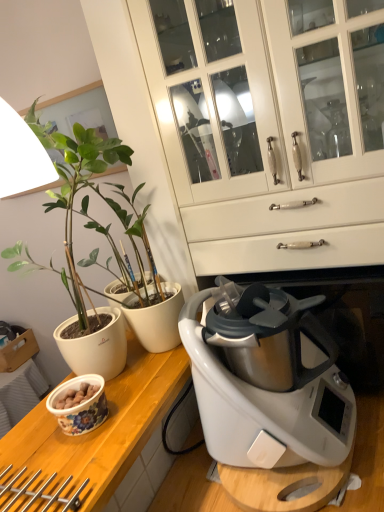
Question: From their relative heights in the image, would you say wooden at left is taller or shorter than matte white pot at left?

Choices:
 (A) tall
 (B) short

Answer: (B)

Question: Considering their positions, is wooden at left located in front of or behind matte white pot at left?

Choices:
 (A) front
 (B) behind

Answer: (A)

Question: Which of these objects is positioned farthest from the white glossy cabinet at center?

Choices:
 (A) floral ceramic bowl at lower left
 (B) wooden at left
 (C) matte white pot at left

Answer: (C)

Question: Which object is positioned farthest from the matte white pot at left?

Choices:
 (A) white glossy cabinet at center
 (B) wooden at left
 (C) floral ceramic bowl at lower left

Answer: (B)